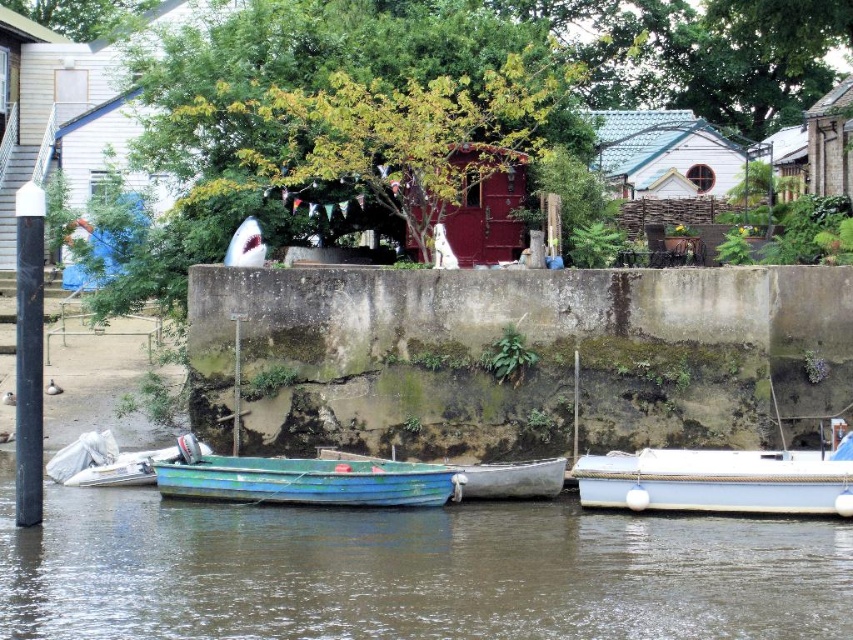
Can you confirm if green matte boat at lower center is shorter than white matte hut at upper center?

Yes.

Can you confirm if green matte boat at lower center is wider than white matte hut at upper center?

Indeed, green matte boat at lower center has a greater width compared to white matte hut at upper center.

Is point (432, 563) closer to viewer compared to point (602, 150)?

Yes, point (432, 563) is closer to viewer.

Identify the location of green matte boat at lower center. The height and width of the screenshot is (640, 853). (410, 572).

Does white glossy boat at center have a greater width compared to rustic wooden hut at center?

Yes, white glossy boat at center is wider than rustic wooden hut at center.

Which is in front, point (618, 474) or point (505, 248)?

Point (618, 474) is more forward.

Is point (834, 435) farther from camera compared to point (486, 180)?

No, (834, 435) is closer to viewer.

This screenshot has width=853, height=640. Identify the location of white glossy boat at center. (722, 480).

Which is behind, point (744, 561) or point (815, 125)?

The point (815, 125) is more distant.

Does green matte boat at lower center have a larger size compared to wooden hut at upper right?

Actually, green matte boat at lower center might be smaller than wooden hut at upper right.

The image size is (853, 640). What do you see at coordinates (410, 572) in the screenshot?
I see `green matte boat at lower center` at bounding box center [410, 572].

Locate an element on the screen. The height and width of the screenshot is (640, 853). green matte boat at lower center is located at coordinates (410, 572).